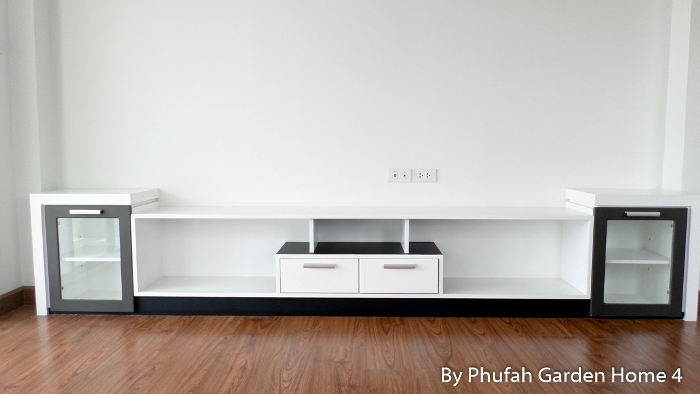
The width and height of the screenshot is (700, 394). I want to click on wall, so click(x=504, y=150).